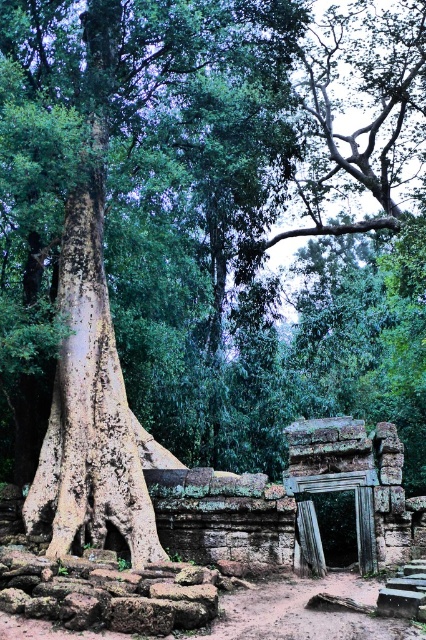
Can you confirm if speckled bark tree trunk at left is shorter than brown rough tree root at lower center?

In fact, speckled bark tree trunk at left may be taller than brown rough tree root at lower center.

Is speckled bark tree trunk at left above brown rough tree root at lower center?

Yes.

Is point (78, 253) farther from viewer compared to point (340, 598)?

That is True.

Locate an element on the screen. The width and height of the screenshot is (426, 640). speckled bark tree trunk at left is located at coordinates pos(89,410).